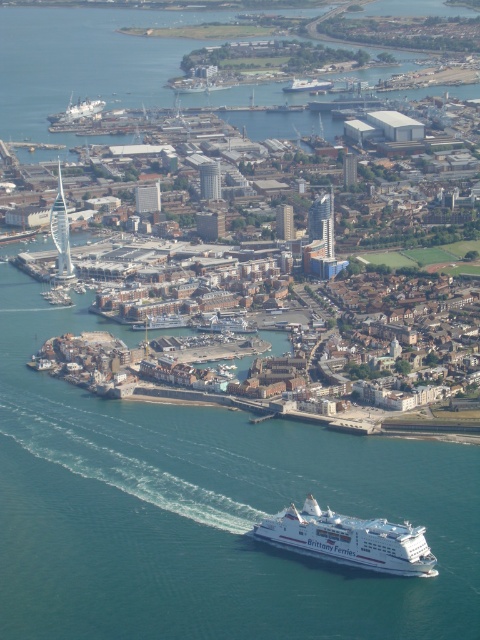
You are a maritime traffic controller observing the coastal city scene. You notice two ferries in the water. Based on their sizes, which ferry, the white matte ferry at lower center or the white glossy ferry at center, would require a larger docking area when arriving at the harbor?

The white matte ferry at lower center requires a larger docking area because it is bigger than the white glossy ferry at center.

From the picture: You are a photographer planning to take a photo of the harbor from a nearby hill. You have two ferries in your viewfinder, the white matte ferry at lower center and the white glossy ferry at center. Which ferry appears taller in the photo?

The white matte ferry at lower center appears taller in the photo because it has a greater height compared to the white glossy ferry at center.

You are a tourist standing at the harbor entrance and see the white matte ferry at lower center and the white glossy ferry at center. Which ferry is positioned to the right side from your viewpoint?

The white matte ferry at lower center is positioned to the right of the white glossy ferry at center from your viewpoint.